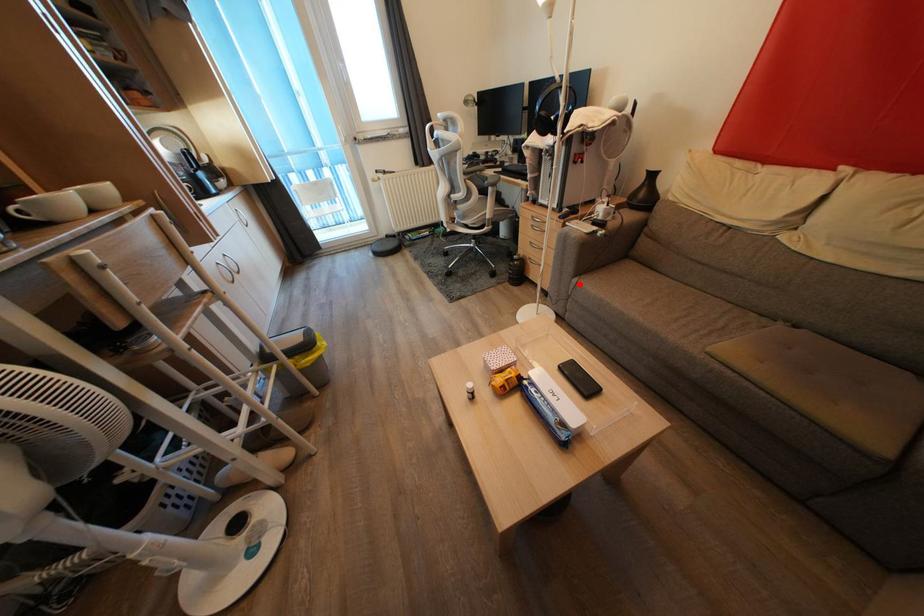
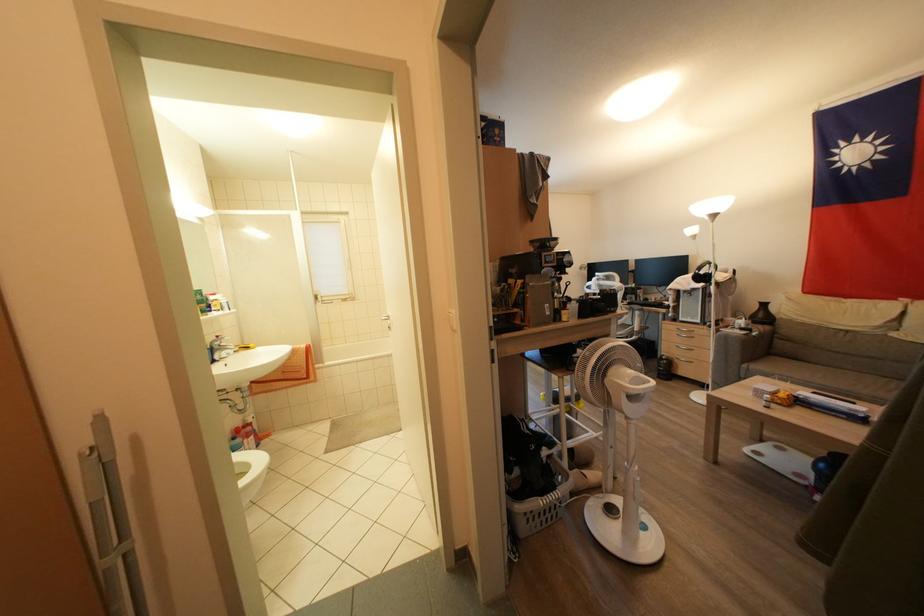
Locate, in the second image, the point that corresponds to the highlighted location in the first image.

(748, 370)